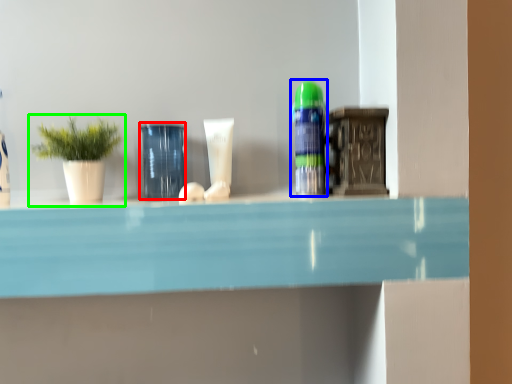
Question: Based on their relative distances, which object is farther from glass vase (highlighted by a red box)? Choose from toiletry (highlighted by a blue box) and houseplant (highlighted by a green box).

Choices:
 (A) toiletry
 (B) houseplant

Answer: (A)